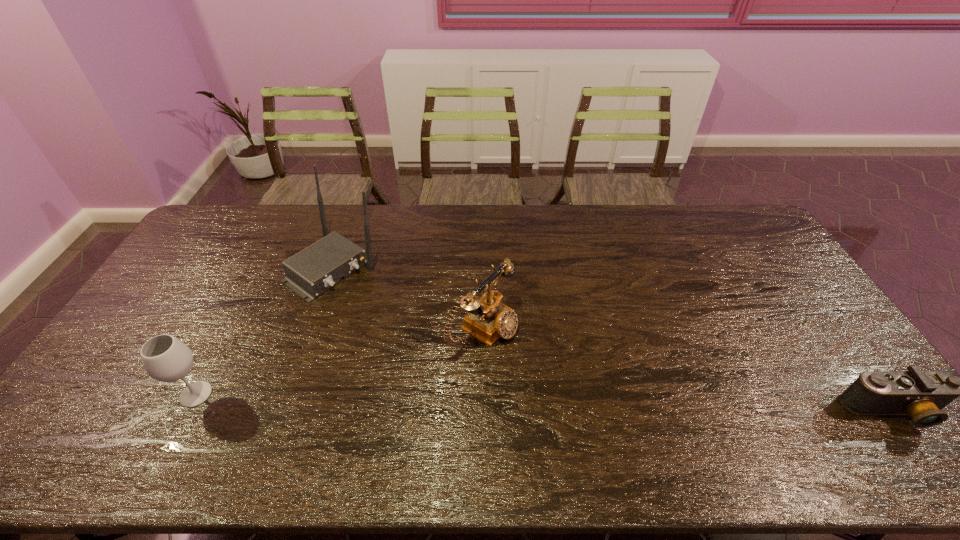
Image resolution: width=960 pixels, height=540 pixels. I want to click on wineglass, so click(x=165, y=358).

Identify the location of the shortest object. click(x=920, y=394).

The height and width of the screenshot is (540, 960). In order to click on the rightmost object in this screenshot , I will do `click(920, 394)`.

In order to click on router in this screenshot , I will do `click(315, 269)`.

The image size is (960, 540). I want to click on the tallest object, so click(315, 269).

Identify the location of telephone. The height and width of the screenshot is (540, 960). (488, 319).

The height and width of the screenshot is (540, 960). I want to click on vacant space situated 0.160m on the right of the leftmost object, so click(276, 394).

Find the location of `free location located 0.270m on the back of the router to connect cables`. free location located 0.270m on the back of the router to connect cables is located at coordinates (424, 330).

Locate an element on the screen. The height and width of the screenshot is (540, 960). free space located on the back of the router to connect cables is located at coordinates click(x=429, y=334).

Locate an element on the screen. The height and width of the screenshot is (540, 960). free location located on the back of the router to connect cables is located at coordinates (410, 321).